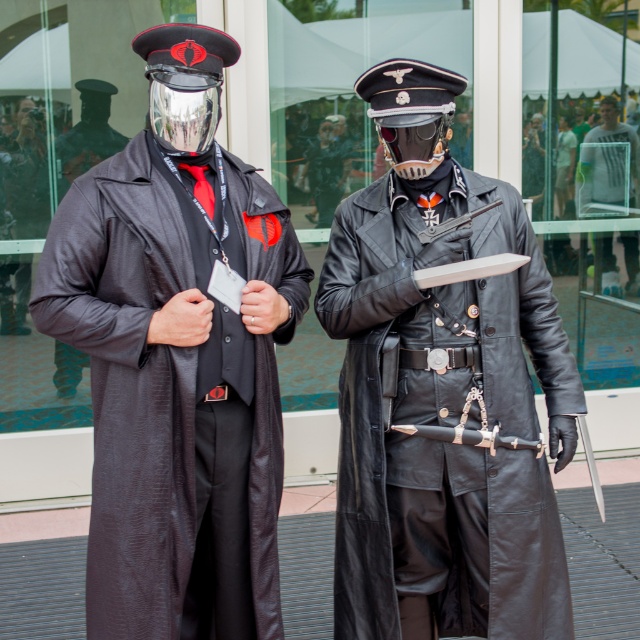
You are a costume designer assessing the spatial compatibility of two garments in a scene. Given the matte black robe at left and the light gray fabric shirt at center, which garment has a wider silhouette when viewed from the front?

The matte black robe at left has a larger width than the light gray fabric shirt at center, so the matte black robe at left has a wider silhouette.

You are a photographer trying to capture the metallic reflective helmet at upper left and the black leather coat at center in a single shot. Based on their positions, which object should you focus on first to ensure both are in frame?

The metallic reflective helmet at upper left should be focused on first since the black leather coat at center is positioned to its right, allowing both to be captured in the frame by starting with the helmet.

You are a photographer standing in front of the glass building. You want to focus your camera on the point that is closer to you. Which point should you choose between point (493, 296) and point (90, 632)?

Point (90, 632) is closer to you than point (493, 296), so you should focus on point (90, 632).